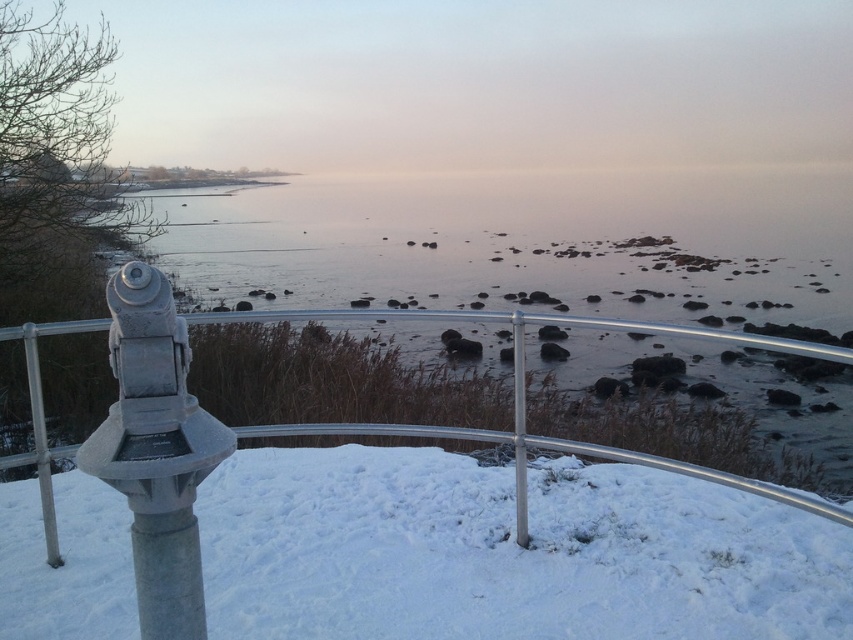
Question: Which of the following is the closest to the observer?

Choices:
 (A) pyautogui.click(x=339, y=317)
 (B) pyautogui.click(x=465, y=561)

Answer: (B)

Question: Among these objects, which one is nearest to the camera?

Choices:
 (A) white fluffy snow at center
 (B) silver metallic fence at center

Answer: (B)

Question: Is white fluffy snow at center above silver metallic fence at center?

Choices:
 (A) yes
 (B) no

Answer: (B)

Question: Which point is closer to the camera taking this photo?

Choices:
 (A) (80, 326)
 (B) (335, 512)

Answer: (A)

Question: Is white fluffy snow at center to the right of silver metallic fence at center from the viewer's perspective?

Choices:
 (A) no
 (B) yes

Answer: (A)

Question: Does white fluffy snow at center have a greater width compared to silver metallic fence at center?

Choices:
 (A) no
 (B) yes

Answer: (B)